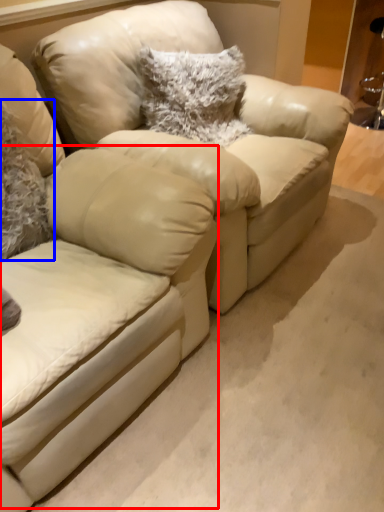
Question: Which object appears farthest to the camera in this image, swivel chair (highlighted by a red box) or pillow (highlighted by a blue box)?

Choices:
 (A) swivel chair
 (B) pillow

Answer: (B)